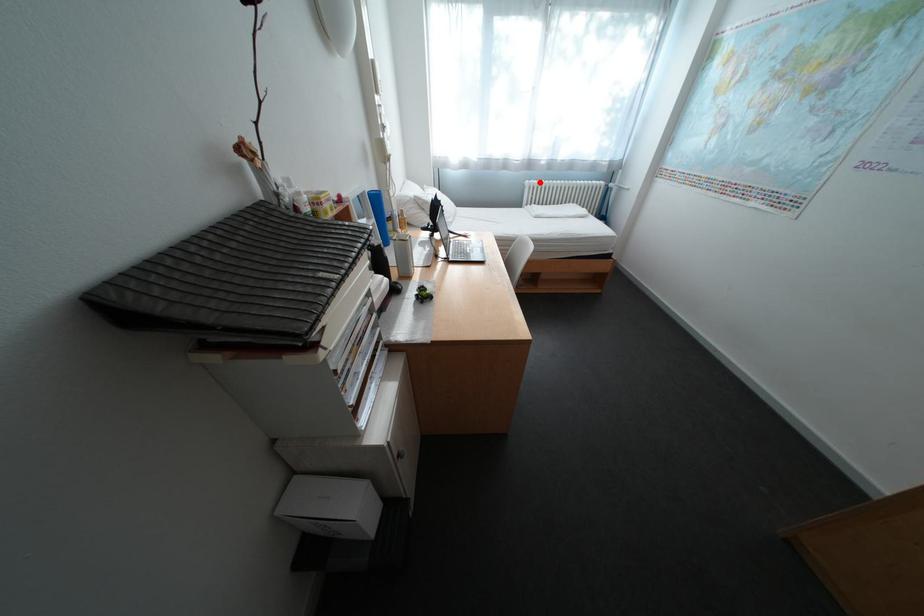
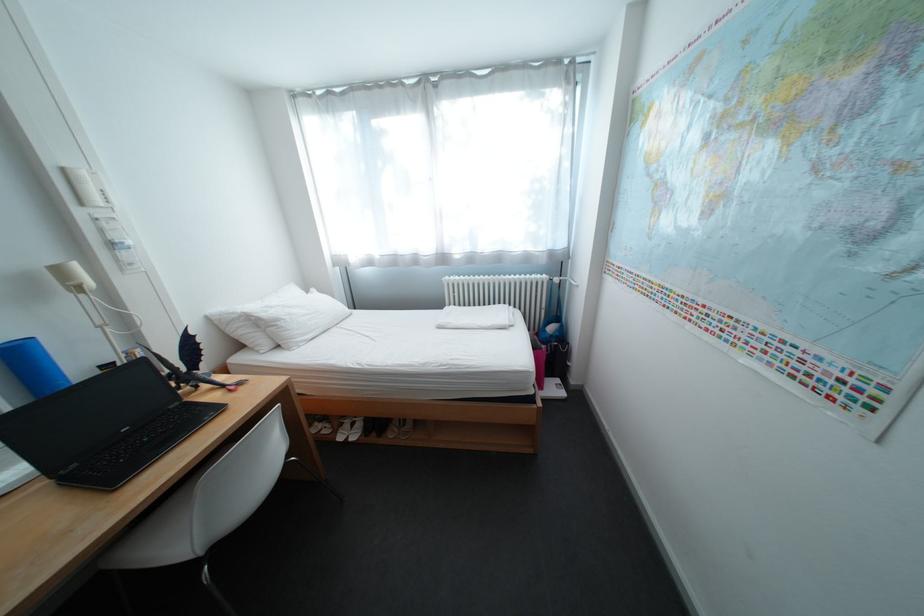
Question: I am providing you with two images of the same scene from different viewpoints. Given a red point in image1, look at the same physical point in image2. Is it:

Choices:
 (A) Closer to the viewpoint
 (B) Farther from the viewpoint

Answer: (B)